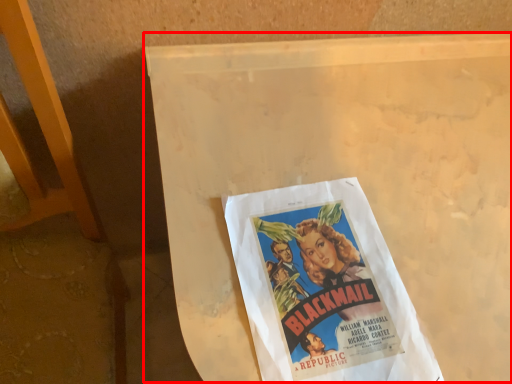
Question: From the image, what is the correct spatial relationship of table (annotated by the red box) in relation to poster?

Choices:
 (A) right
 (B) left

Answer: (A)